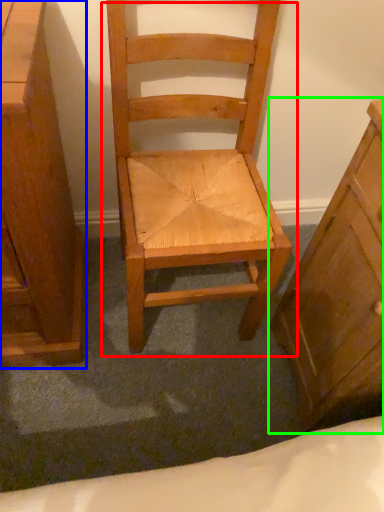
Question: Estimate the real-world distances between objects in this image. Which object is closer to chair (highlighted by a red box), chest of drawers (highlighted by a blue box) or chest of drawers (highlighted by a green box)?

Choices:
 (A) chest of drawers
 (B) chest of drawers

Answer: (B)